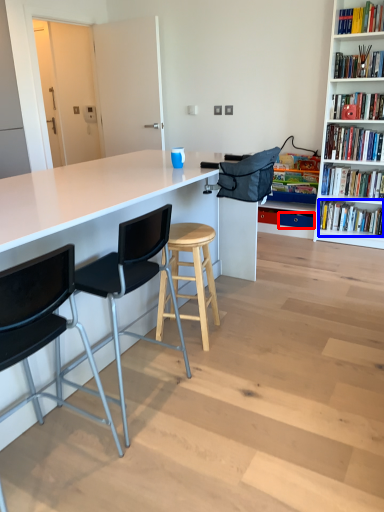
Question: Which object appears farthest to the camera in this image, drawer (highlighted by a red box) or book (highlighted by a blue box)?

Choices:
 (A) drawer
 (B) book

Answer: (A)